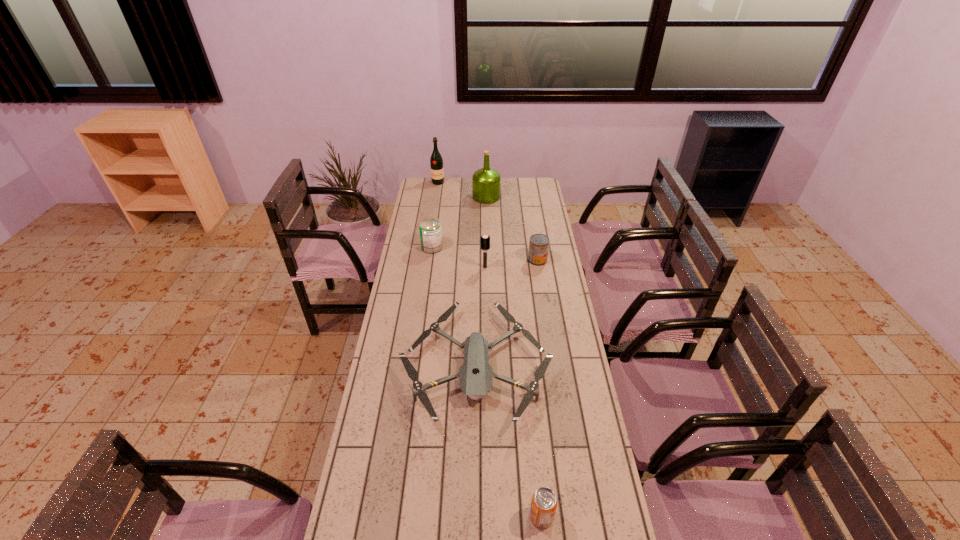
Where is `vacant space located 0.290m on the front of the olive oil`? This screenshot has height=540, width=960. vacant space located 0.290m on the front of the olive oil is located at coordinates (487, 234).

Where is `vacant space located 0.260m on the left of the hairbrush`? This screenshot has width=960, height=540. vacant space located 0.260m on the left of the hairbrush is located at coordinates (425, 267).

Image resolution: width=960 pixels, height=540 pixels. In order to click on vacant region located on the back of the taller can in this screenshot , I will do `click(435, 227)`.

The width and height of the screenshot is (960, 540). Find the location of `vacant space located on the left of the shorter can`. vacant space located on the left of the shorter can is located at coordinates (446, 260).

This screenshot has width=960, height=540. Identify the location of free spot located 0.300m on the back of the nearest object. (531, 411).

Image resolution: width=960 pixels, height=540 pixels. Find the location of `free space located with a camera mounted on the front of the second nearest object`. free space located with a camera mounted on the front of the second nearest object is located at coordinates (475, 451).

Locate an element on the screen. Image resolution: width=960 pixels, height=540 pixels. liquor at the far edge is located at coordinates (436, 162).

Where is `olive oil present at the far edge`? olive oil present at the far edge is located at coordinates (486, 181).

At what (x,y) coordinates should I click in order to perform the action: click on liquor positioned at the left edge. Please return your answer as a coordinate pair (x, y). This screenshot has height=540, width=960. Looking at the image, I should click on (436, 162).

Where is `can located at the left edge`? The height and width of the screenshot is (540, 960). can located at the left edge is located at coordinates (430, 229).